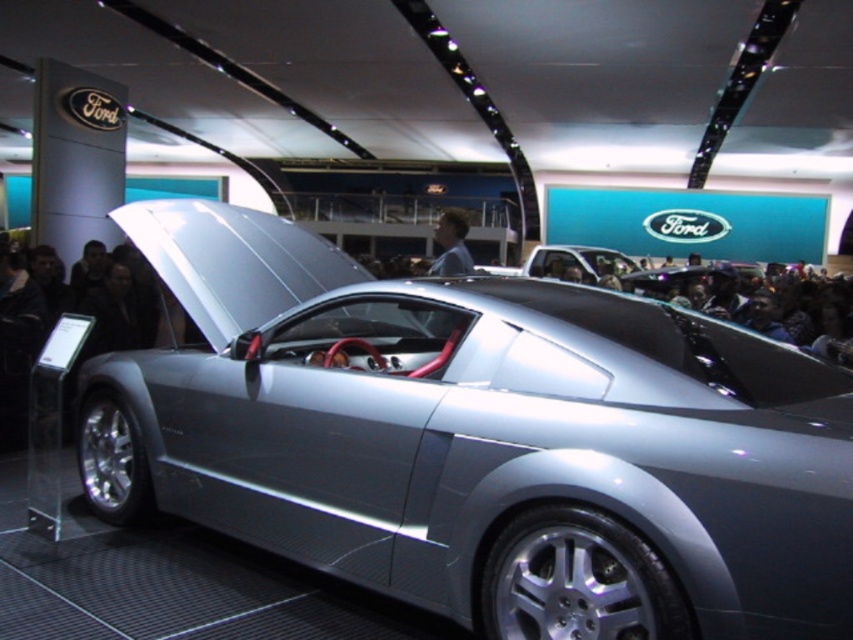
You are standing in front of the futuristic concept car at the auto show. There are two points marked on the car, one at point coordinates (587, 246) and another at point coordinates (442, 232). Which point is closer to you?

Point coordinates (587, 246) is further to the viewer than point coordinates (442, 232), so the point at (442, 232) is closer to you.

You are a photographer standing at the entrance of the auto show. You want to capture a clear photo of the satin silver car at center without any people in the frame. The camera you are using has a maximum zoom range of 10 meters. Can you take the photo from your current position?

The satin silver car at center and camera are 13.35 meters apart, which is beyond the camera maximum zoom range of 10 meters. Therefore, you cannot take the photo from your current position.

You are a photographer at the auto show and want to capture both the satin silver car at center and the smooth skin face at center in a single frame. Based on their sizes in the image, which object would you need to position closer to the camera to ensure both fit adequately?

The satin silver car at center occupies less space than the smooth skin face at center. To ensure both fit in the frame, you should position the smooth skin face at center closer to the camera since it takes up more space and needs to be scaled down, while the satin silver car at center can be farther away to maintain its smaller size.